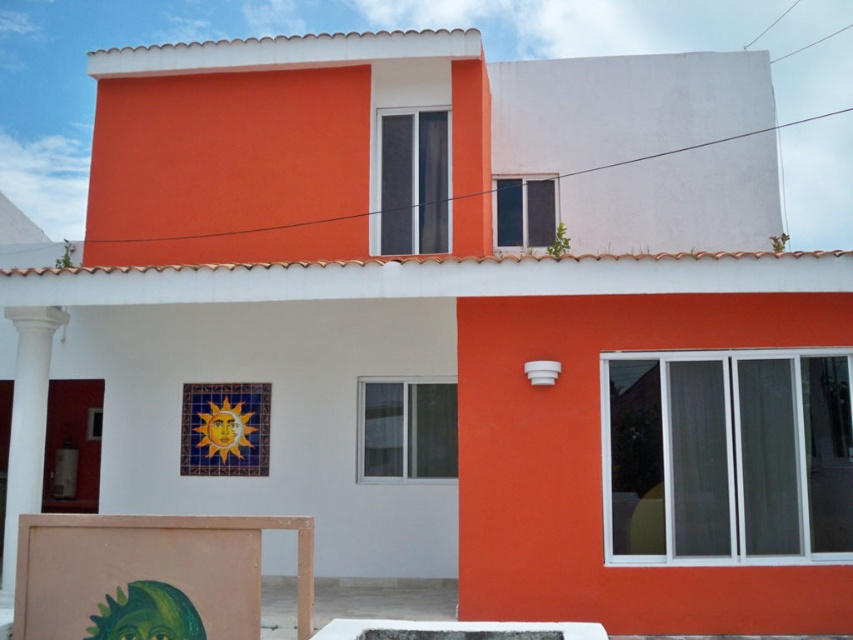
Question: Is matte pink easel at lower left below white smooth column at left?

Choices:
 (A) yes
 (B) no

Answer: (A)

Question: Among these points, which one is farthest from the camera?

Choices:
 (A) (16, 564)
 (B) (25, 500)

Answer: (B)

Question: Does matte pink easel at lower left appear over white smooth column at left?

Choices:
 (A) yes
 (B) no

Answer: (B)

Question: From the image, what is the correct spatial relationship of matte pink easel at lower left in relation to white smooth column at left?

Choices:
 (A) left
 (B) right

Answer: (B)